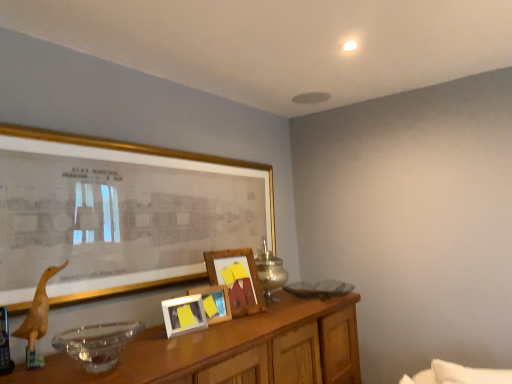
I want to click on free spot to the right of wooden picture frame at center, acting as the 4th picture frame starting from the front, so click(267, 305).